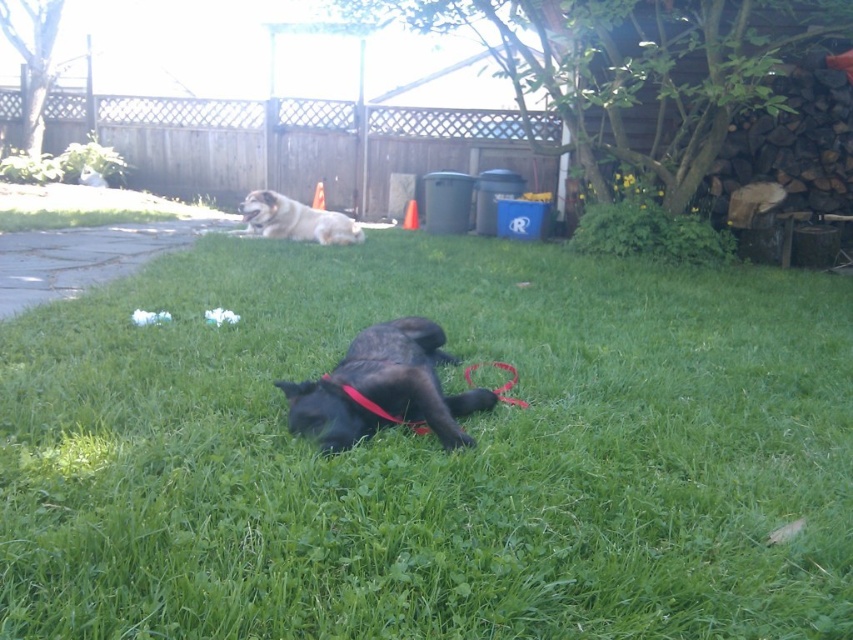
You are standing at the point with coordinates point (355, 340) and want to walk to the point with coordinates point (514, 490). Which direction should you move in to reach your destination?

You should move forward because point (514, 490) is in front of point (355, 340).

You are a photographer setting up a camera to capture both the shiny black dog at center and the fuzzy brown dog at upper center in the same frame. Given their sizes, which dog would you need to position closer to the camera to ensure both appear similarly sized in the photo?

The shiny black dog at center has a lesser width compared to the fuzzy brown dog at upper center, so you should position the shiny black dog at center closer to the camera to make them appear similar in size.

You are standing in the backyard and want to walk from the green grass at center to the fuzzy brown dog at upper center. Which direction should you move to get there?

The green grass at center is on the right side of the fuzzy brown dog at upper center, so to reach the dog from the grass, you should move to the left.